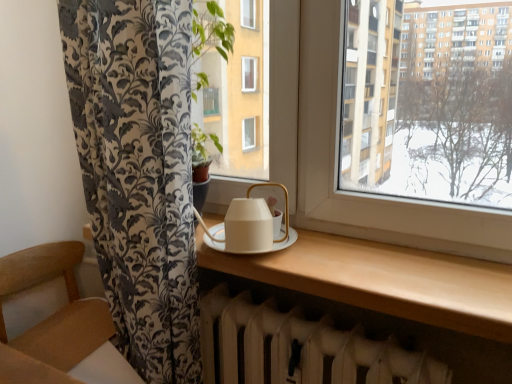
Question: Considering their positions, is white matte radiator at lower center located in front of or behind white matte tea set at center?

Choices:
 (A) front
 (B) behind

Answer: (A)

Question: Choose the correct answer: Is white matte radiator at lower center inside white matte tea set at center or outside it?

Choices:
 (A) inside
 (B) outside

Answer: (B)

Question: Which of these objects is positioned farthest from the matte white table at center?

Choices:
 (A) white matte tea set at center
 (B) white matte radiator at lower center
 (C) wooden armchair at lower left

Answer: (C)

Question: Estimate the real-world distances between objects in this image. Which object is closer to the wooden armchair at lower left?

Choices:
 (A) matte white table at center
 (B) white matte tea set at center
 (C) white matte radiator at lower center

Answer: (C)